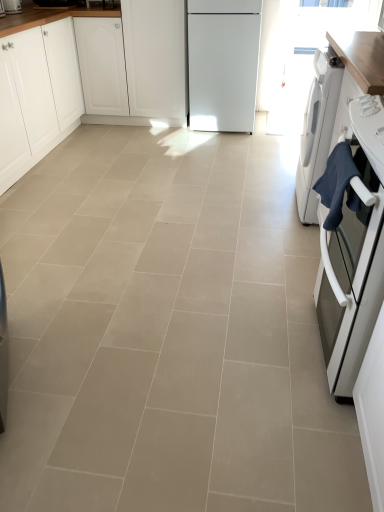
I want to click on vacant region to the left of white glossy washing machine at right, which is counted as the first home appliance, starting from the back, so click(x=253, y=205).